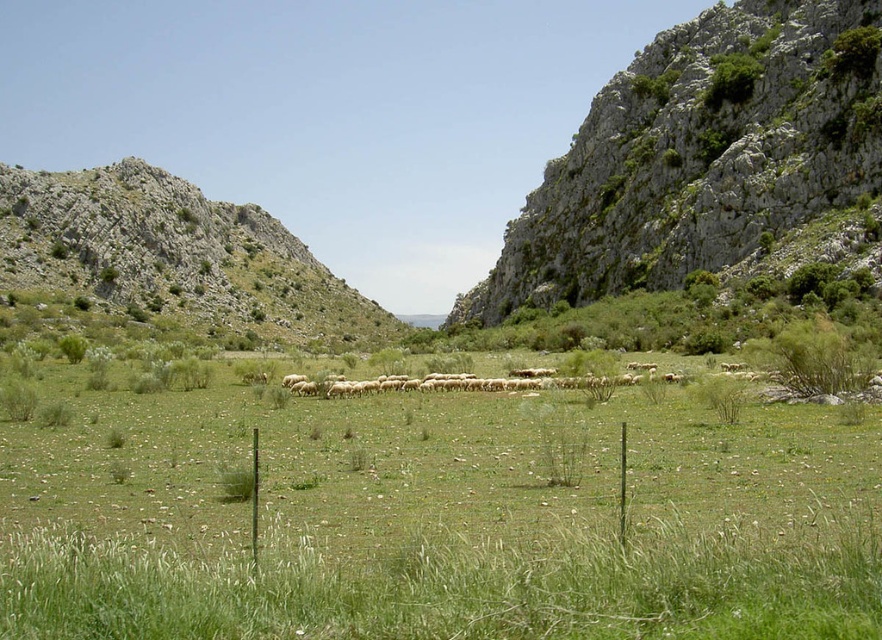
Is green rocky hillside at upper right wider than rugged stone hillside at left?

Incorrect, green rocky hillside at upper right's width does not surpass rugged stone hillside at left's.

Is point (689, 164) positioned in front of point (259, 326)?

That is True.

Is point (760, 64) behind point (200, 289)?

No.

You are a GUI agent. You are given a task and a screenshot of the screen. Output one action in this format:
    pyautogui.click(x=<x>, y=<y>)
    Task: Click on the green rocky hillside at upper right
    This screenshot has height=640, width=882.
    Given the screenshot: What is the action you would take?
    pyautogui.click(x=699, y=154)